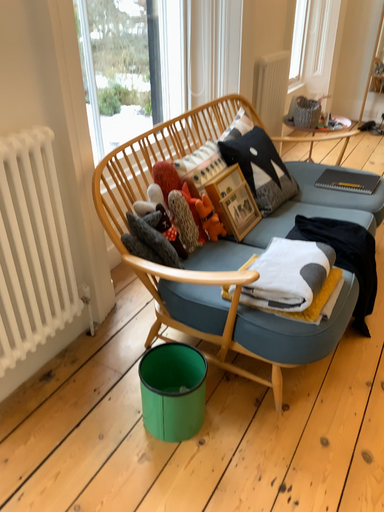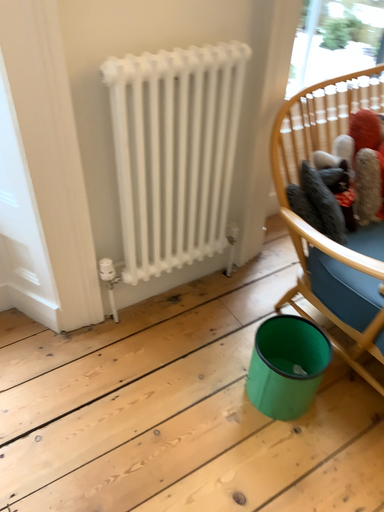
Question: How did the camera likely rotate when shooting the video?

Choices:
 (A) rotated right
 (B) rotated left

Answer: (B)